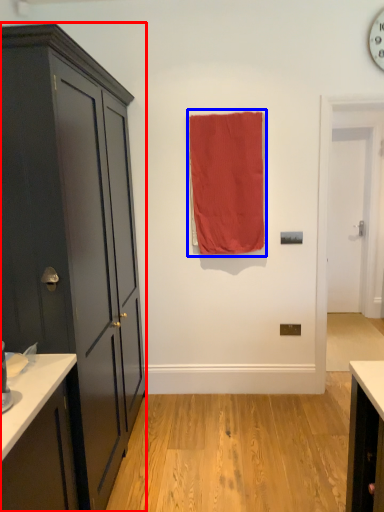
Question: Which of the following is the farthest to the observer, cabinetry (highlighted by a red box) or curtain (highlighted by a blue box)?

Choices:
 (A) cabinetry
 (B) curtain

Answer: (B)